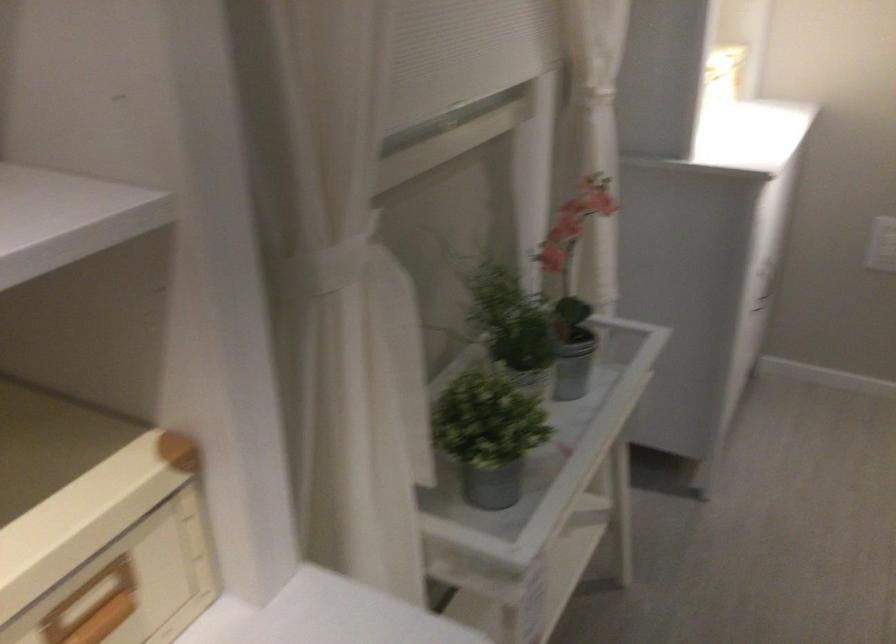
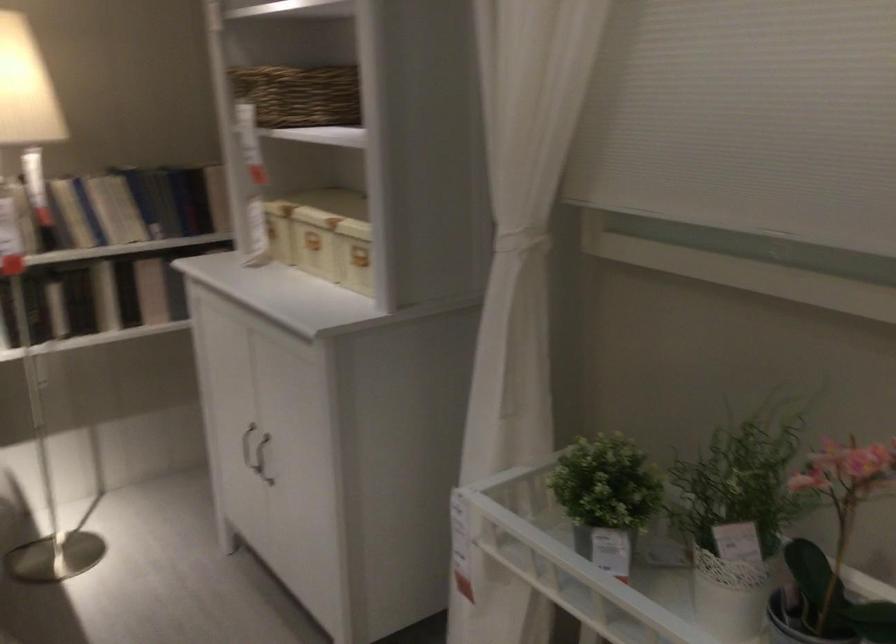
In the second image, find the point that corresponds to point (509, 351) in the first image.

(735, 518)